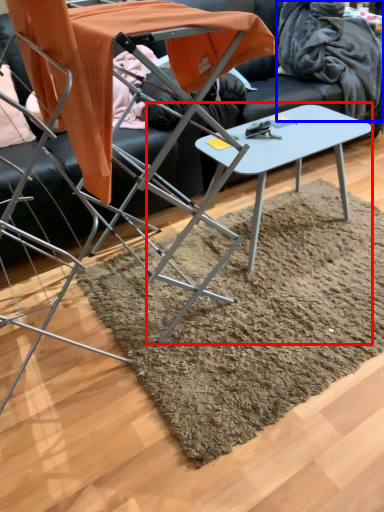
Question: Among these objects, which one is nearest to the camera, table (highlighted by a red box) or blanket (highlighted by a blue box)?

Choices:
 (A) table
 (B) blanket

Answer: (A)